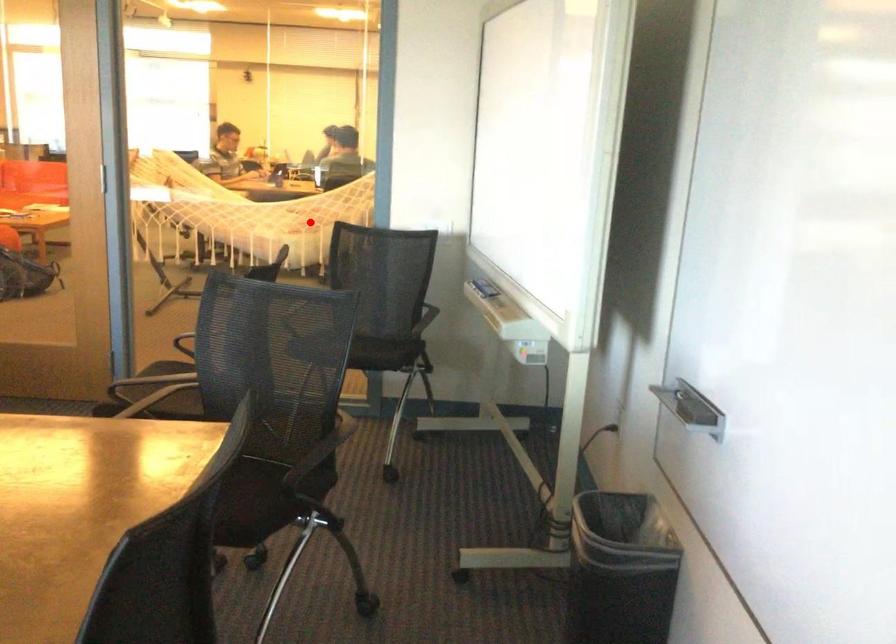
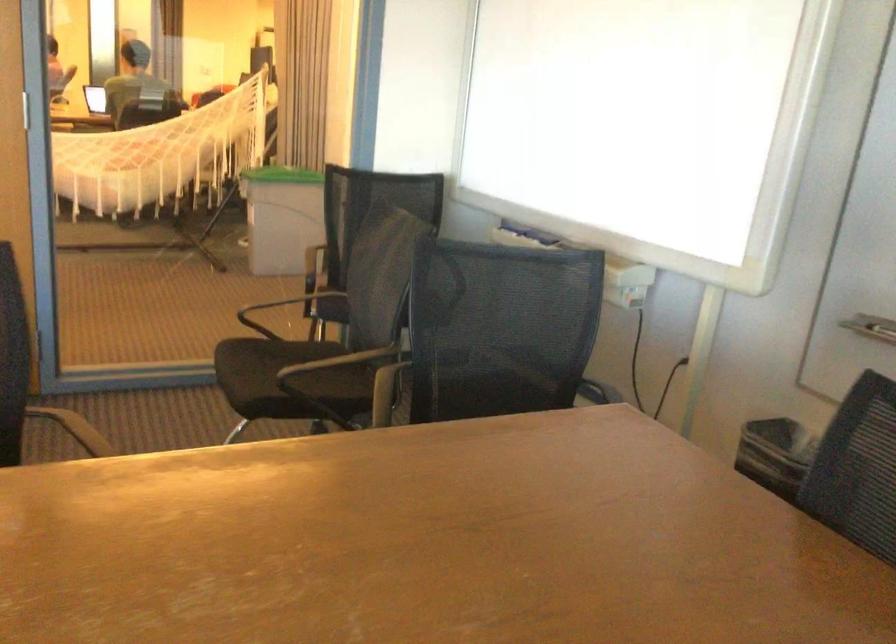
In the second image, find the point that corresponds to the highlighted location in the first image.

(161, 156)